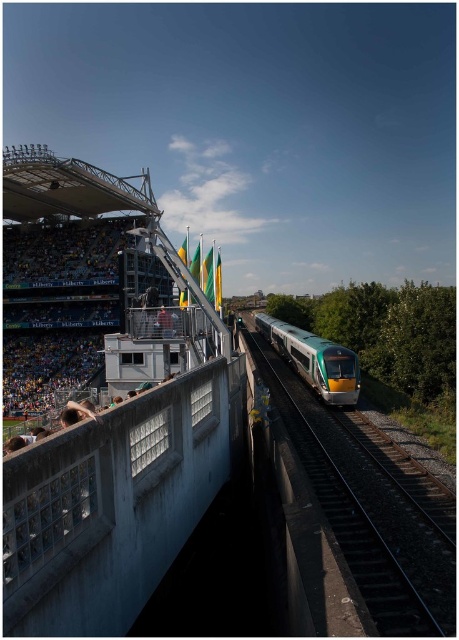
In the scene shown: You are a railway engineer assessing the layout of the tracks. The green metallic train at center is currently on the green metallic train track at center. If the train needs to make an emergency stop, will the track be long enough to accommodate the train? Explain your reasoning based on their sizes.

The green metallic train track at center is shorter than the green metallic train at center. Therefore, the track is not long enough to accommodate the entire length of the train if it makes an emergency stop.

You are a maintenance worker responsible for ensuring the safety of the railway system. You need to inspect the distance between the green metallic train track at center and the green metallic train at center. According to the safety regulations, the minimum safe distance required is 10 meters. Is the current distance compliant with the regulations?

The green metallic train track at center is 9.60 meters from the green metallic train at center. Since the required minimum safe distance is 10 meters, the current distance of 9.60 meters is below the required threshold. Therefore, the current distance is not compliant with the safety regulations.

You are a railway inspector checking the train and its track. You notice the green metallic train at center and the green metallic train track at center. Which one has a smaller size?

The green metallic train track at center has a smaller size compared to the green metallic train at center.